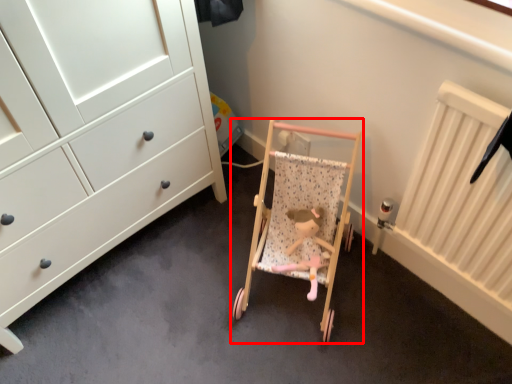
Question: From the image, what is the correct spatial relationship of furniture (annotated by the red box) in relation to toy?

Choices:
 (A) left
 (B) right

Answer: (A)